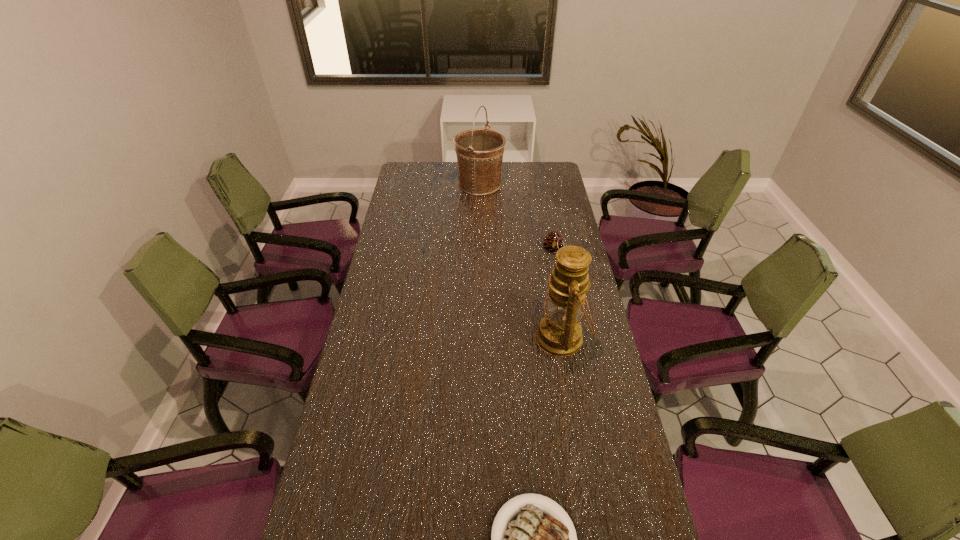
Image resolution: width=960 pixels, height=540 pixels. I want to click on the farthest object, so coord(479,152).

Identify the location of oil lamp. (559, 333).

Locate an element on the screen. Image resolution: width=960 pixels, height=540 pixels. pinecone is located at coordinates (553, 242).

Locate an element on the screen. the second farthest object is located at coordinates (553, 242).

You are a GUI agent. You are given a task and a screenshot of the screen. Output one action in this format:
    pyautogui.click(x=<x>, y=<y>)
    Task: Click on the vacant position located on the back of the bucket
    Image resolution: width=960 pixels, height=540 pixels.
    Given the screenshot: What is the action you would take?
    pyautogui.click(x=479, y=165)

Locate an element on the screen. This screenshot has height=540, width=960. vacant area situated on the front of the oil lamp is located at coordinates (575, 414).

You are a GUI agent. You are given a task and a screenshot of the screen. Output one action in this format:
    pyautogui.click(x=<x>, y=<y>)
    Task: Click on the blank space located 0.220m with a leaf charm attached to the third tallest object
    Image resolution: width=960 pixels, height=540 pixels.
    Given the screenshot: What is the action you would take?
    pyautogui.click(x=562, y=298)

The width and height of the screenshot is (960, 540). Identify the location of object at the far edge. (479, 152).

Identify the location of oil lamp that is at the right edge. (559, 333).

Where is `pinecone that is at the right edge`? The height and width of the screenshot is (540, 960). pinecone that is at the right edge is located at coordinates (553, 242).